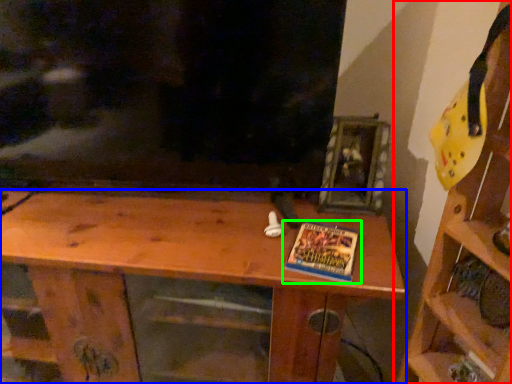
Question: Estimate the real-world distances between objects in this image. Which object is farther from shelf (highlighted by a red box), shelf (highlighted by a blue box) or book (highlighted by a green box)?

Choices:
 (A) shelf
 (B) book

Answer: (A)